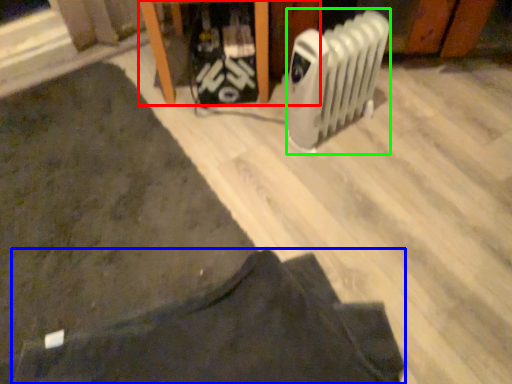
Question: Considering the real-world distances, which object is closest to furniture (highlighted by a red box)? clothing (highlighted by a blue box) or radiator (highlighted by a green box).

Choices:
 (A) clothing
 (B) radiator

Answer: (B)